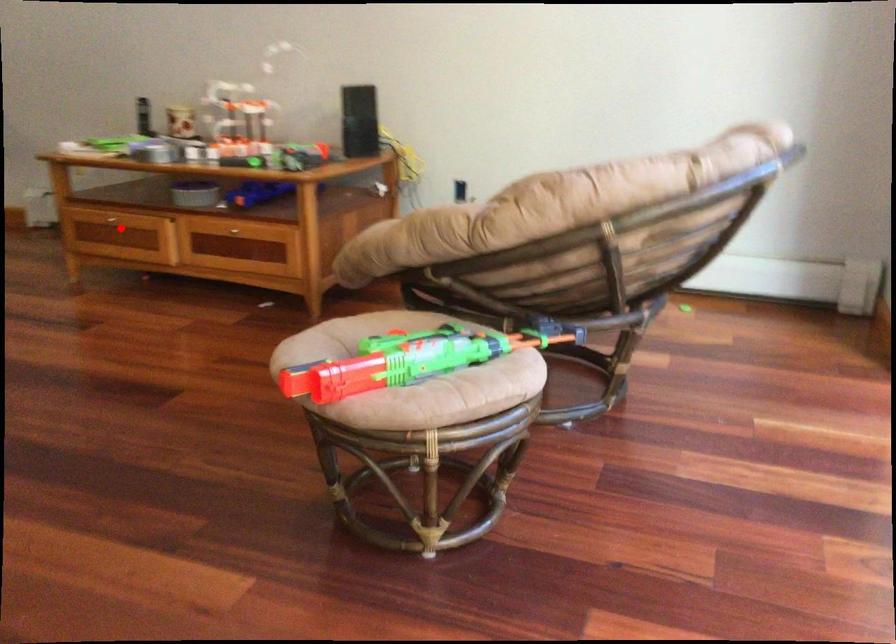
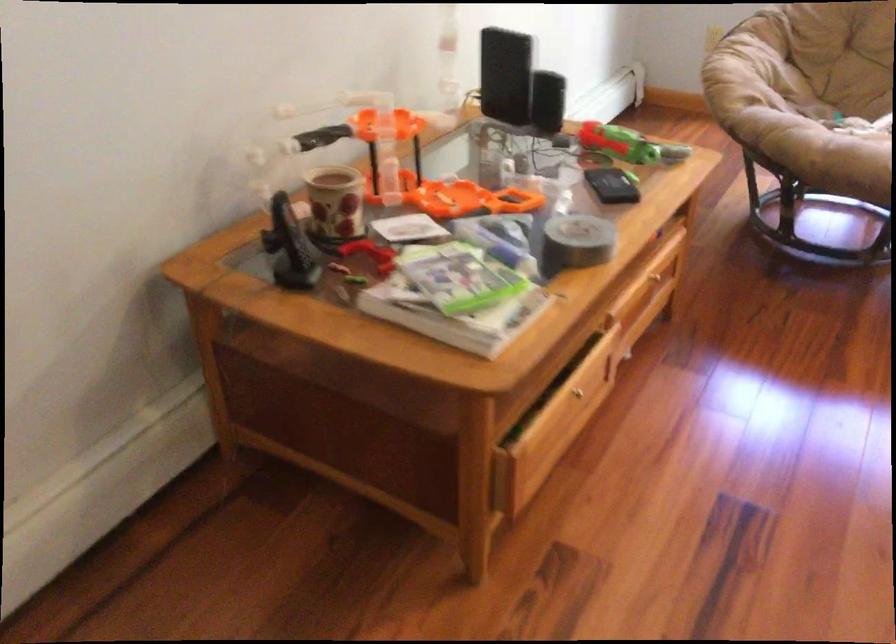
Question: I am providing you with two images of the same scene from different viewpoints. Image1 has a red point marked. In image2, the corresponding 3D location appears at what relative position? Reply with the corresponding letter.

Choices:
 (A) Closer
 (B) Farther

Answer: (A)